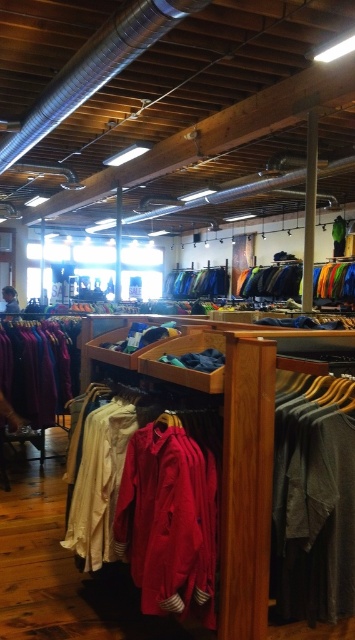
You are a customer in the clothing store and want to know which item takes up more horizontal space on the shelf. Which one is wider, the dark gray fabric shirt at center or the velvet purple sweater at left?

The velvet purple sweater at left is wider than the dark gray fabric shirt at center.

You are a customer in the clothing store. You want to pick up the dark gray fabric shirt at center and the velvet purple sweater at left. Can you walk directly between them without needing to move any items?

The distance between the dark gray fabric shirt at center and the velvet purple sweater at left is 10.68 feet, which is a considerable space. Therefore, you can easily walk directly between them without needing to move any items.